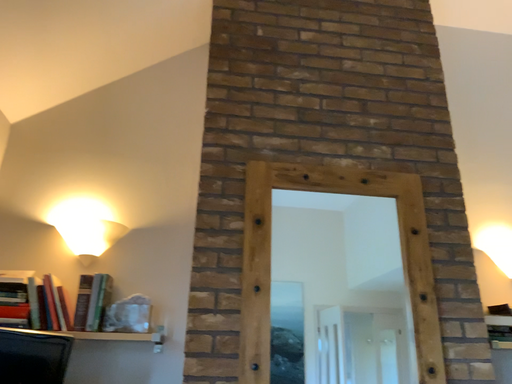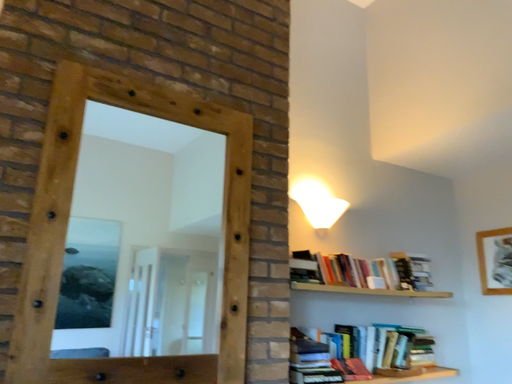
Question: How did the camera likely rotate when shooting the video?

Choices:
 (A) rotated right
 (B) rotated left

Answer: (A)